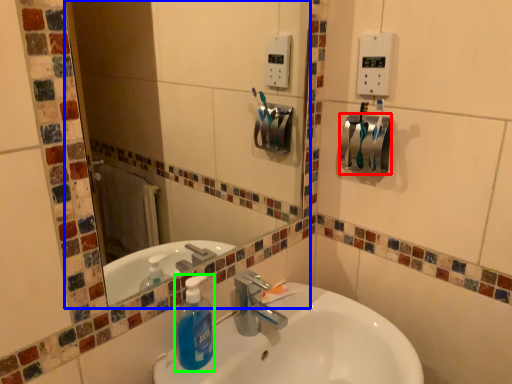
Question: Which is farther away from towel bar (highlighted by a red box)? mirror (highlighted by a blue box) or cleaning product (highlighted by a green box)?

Choices:
 (A) mirror
 (B) cleaning product

Answer: (A)